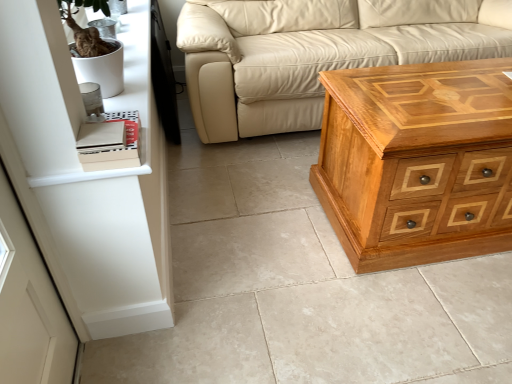
What is the approximate width of beige leather couch at center?

The width of beige leather couch at center is 38.33 inches.

Where is `polished wood chest of drawers at right`? The height and width of the screenshot is (384, 512). polished wood chest of drawers at right is located at coordinates (414, 161).

I want to click on beige leather couch at center, so click(x=314, y=57).

Is white matte shelf at upper left wider than polished wood chest of drawers at right?

In fact, white matte shelf at upper left might be narrower than polished wood chest of drawers at right.

I want to click on shelf above the polished wood chest of drawers at right (from the image's perspective), so click(64, 90).

Which point is more forward, (151, 172) or (375, 169)?

The point (375, 169) is more forward.

Between white matte shelf at upper left and polished wood chest of drawers at right, which one has smaller size?

white matte shelf at upper left.

Considering the sizes of objects white matte shelf at upper left and beige leather couch at center in the image provided, who is taller, white matte shelf at upper left or beige leather couch at center?

beige leather couch at center is taller.

In the scene shown: Looking at their sizes, would you say white matte shelf at upper left is wider or thinner than beige leather couch at center?

In the image, white matte shelf at upper left appears to be more narrow than beige leather couch at center.

Who is more distant, white matte shelf at upper left or beige leather couch at center?

beige leather couch at center.

Is point (25, 57) closer or farther from the camera than point (213, 90)?

Point (25, 57) is positioned closer to the camera compared to point (213, 90).

Is polished wood chest of drawers at right aimed at white matte shelf at upper left?

No, polished wood chest of drawers at right does not turn towards white matte shelf at upper left.

Would you consider polished wood chest of drawers at right to be distant from white matte shelf at upper left?

No, polished wood chest of drawers at right is not far from white matte shelf at upper left.

Based on the photo, does polished wood chest of drawers at right have a lesser width compared to white matte shelf at upper left?

In fact, polished wood chest of drawers at right might be wider than white matte shelf at upper left.

Is polished wood chest of drawers at right shorter than white matte shelf at upper left?

No, polished wood chest of drawers at right is not shorter than white matte shelf at upper left.

Find the location of `studio couch on the left of polished wood chest of drawers at right`. studio couch on the left of polished wood chest of drawers at right is located at coordinates (314, 57).

Could you tell me if polished wood chest of drawers at right is turned towards beige leather couch at center?

No, polished wood chest of drawers at right is not oriented towards beige leather couch at center.

Is polished wood chest of drawers at right wider or thinner than beige leather couch at center?

In the image, polished wood chest of drawers at right appears to be more narrow than beige leather couch at center.

Can you tell me how much polished wood chest of drawers at right and beige leather couch at center differ in facing direction?

The angle between the facing direction of polished wood chest of drawers at right and the facing direction of beige leather couch at center is 0.229 degrees.

Which object is thinner, beige leather couch at center or white matte shelf at upper left?

white matte shelf at upper left.

Would you say beige leather couch at center is inside or outside white matte shelf at upper left?

beige leather couch at center is not inside white matte shelf at upper left, it's outside.

From a real-world perspective, does beige leather couch at center sit lower than white matte shelf at upper left?

Correct, in the physical world, beige leather couch at center is lower than white matte shelf at upper left.

Is beige leather couch at center oriented away from white matte shelf at upper left?

That's not correct — beige leather couch at center is not looking away from white matte shelf at upper left.

From the image's perspective, is beige leather couch at center located above or below polished wood chest of drawers at right?

Clearly, from the image's perspective, beige leather couch at center is above polished wood chest of drawers at right.

Is polished wood chest of drawers at right a part of beige leather couch at center?

No, polished wood chest of drawers at right is not inside beige leather couch at center.

Is beige leather couch at center not near polished wood chest of drawers at right?

No.

Is beige leather couch at center looking in the opposite direction of polished wood chest of drawers at right?

No, beige leather couch at center is not facing away from polished wood chest of drawers at right.

Find the location of a particular element. The width and height of the screenshot is (512, 384). shelf located on the left of polished wood chest of drawers at right is located at coordinates (64, 90).

Locate an element on the screen. Image resolution: width=512 pixels, height=384 pixels. studio couch that is above the white matte shelf at upper left (from the image's perspective) is located at coordinates (314, 57).

Estimate the real-world distances between objects in this image. Which object is further from white matte shelf at upper left, beige leather couch at center or polished wood chest of drawers at right?

beige leather couch at center.

When comparing their distances from beige leather couch at center, does polished wood chest of drawers at right or white matte shelf at upper left seem closer?

Among the two, polished wood chest of drawers at right is located nearer to beige leather couch at center.

From the image, which object appears to be farther from beige leather couch at center, white matte shelf at upper left or polished wood chest of drawers at right?

The object further to beige leather couch at center is white matte shelf at upper left.

Based on their spatial positions, is white matte shelf at upper left or beige leather couch at center closer to polished wood chest of drawers at right?

Based on the image, beige leather couch at center appears to be nearer to polished wood chest of drawers at right.

Which object lies nearer to the anchor point polished wood chest of drawers at right, beige leather couch at center or white matte shelf at upper left?

beige leather couch at center is closer to polished wood chest of drawers at right.

Consider the image. From the image, which object appears to be nearer to white matte shelf at upper left, polished wood chest of drawers at right or beige leather couch at center?

Based on the image, polished wood chest of drawers at right appears to be nearer to white matte shelf at upper left.

You are a GUI agent. You are given a task and a screenshot of the screen. Output one action in this format:
    pyautogui.click(x=<x>, y=<y>)
    Task: Click on the studio couch located between white matte shelf at upper left and polished wood chest of drawers at right in the left-right direction
    The image size is (512, 384).
    Given the screenshot: What is the action you would take?
    pyautogui.click(x=314, y=57)